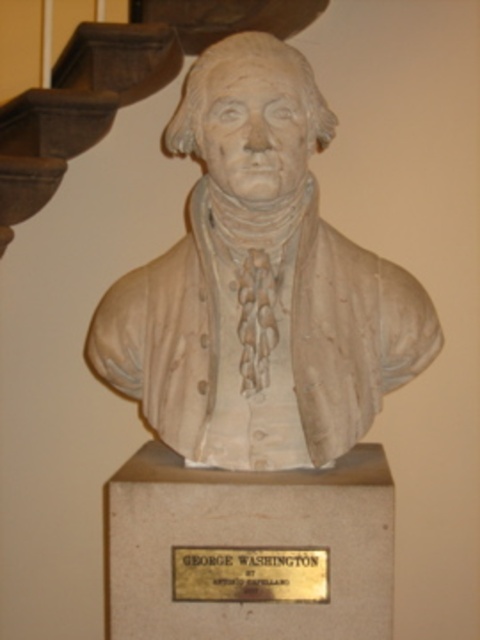
You are an art conservator examining the image. You need to determine if the dark brown wood at upper left can be placed on top of the white marble bust at center without causing damage. Based on their sizes, what should you consider?

The white marble bust at center is larger in size than the dark brown wood at upper left, so placing the smaller dark brown wood at upper left on top of the larger white marble bust at center would likely be stable and not cause damage.

You are an art curator planning to install a spotlight on the white marble bust at center. The spotlight has a beam angle of 30 degrees. Given the coordinates of the bust at point 0.445, 0.542, can you determine if the spotlight will illuminate the entire bust?

The coordinates of the white marble bust at center are at point (260,284). However, without knowing the dimensions of the bust or the distance from the spotlight, it is impossible to determine if the spotlight will illuminate the entire bust.